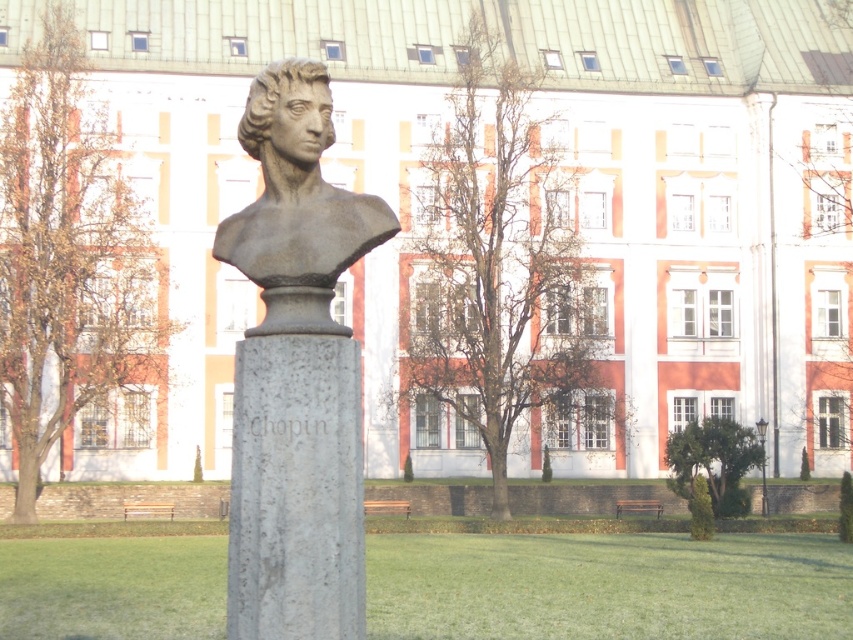
You are an art student visiting the Chopin statue and need to sketch both the gray stone column at center and the bronze statue at center. Which object should you draw first if you want to start with the smaller one?

The gray stone column at center is smaller than the bronze statue at center, so you should draw the gray stone column at center first.

You are standing in front of the statue of Fryderyk Chopin and want to take a photo of the gray stone column at center. Where should you position yourself to capture it in the frame?

To capture the gray stone column at center in your photo, position yourself directly in front of the statue of Fryderyk Chopin, as the gray stone column at center is located at the central point of the image, specifically at coordinates 0.767 on the x axis and 0.348 on the y axis.

You are an architect designing a new park layout. You need to place a new bench between the gray stone column at center and the bronze statue at center. Which side of the column should the bench be placed on to ensure it doesn

The gray stone column at center is thinner than the bronze statue at center, so placing the bench on the side of the gray stone column at center would provide more space between the bench and the thicker bronze statue at center.